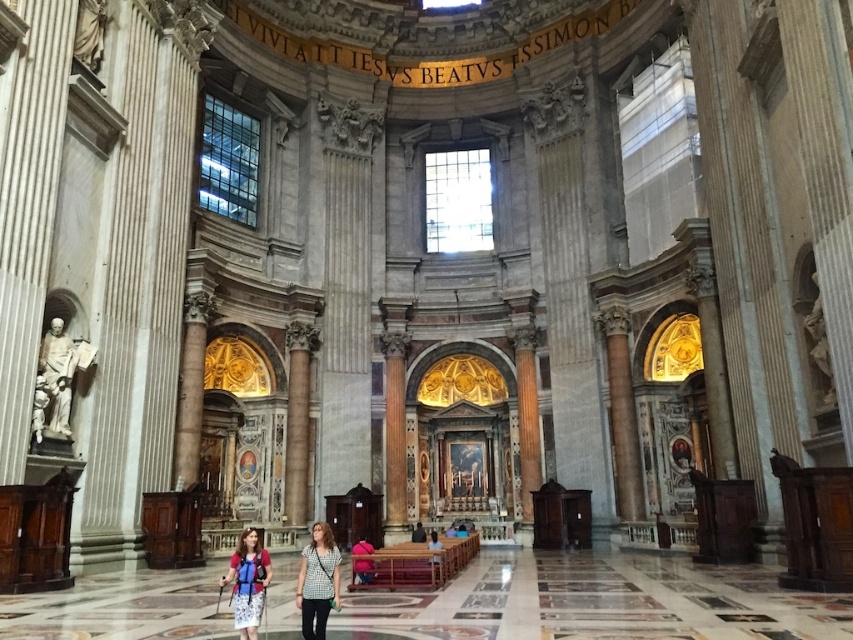
Question: From the image, what is the correct spatial relationship of white marble statue at left in relation to matte blue dress at center?

Choices:
 (A) below
 (B) above

Answer: (B)

Question: Can you confirm if checkered fabric shirt at center is thinner than light brown leather jacket at center?

Choices:
 (A) no
 (B) yes

Answer: (A)

Question: Can you confirm if matte blue dress at center is positioned to the right of matte black backpack at center?

Choices:
 (A) no
 (B) yes

Answer: (A)

Question: Which is nearer to the matte pink sweater at center?

Choices:
 (A) white marble statue at left
 (B) light brown leather jacket at center

Answer: (B)

Question: Estimate the real-world distances between objects in this image. Which object is farther from the matte blue dress at center?

Choices:
 (A) matte pink sweater at center
 (B) checkered fabric shirt at center

Answer: (A)

Question: Which object appears closest to the camera in this image?

Choices:
 (A) white marble statue at left
 (B) matte blue dress at center
 (C) checkered fabric shirt at center
 (D) matte black backpack at center

Answer: (B)